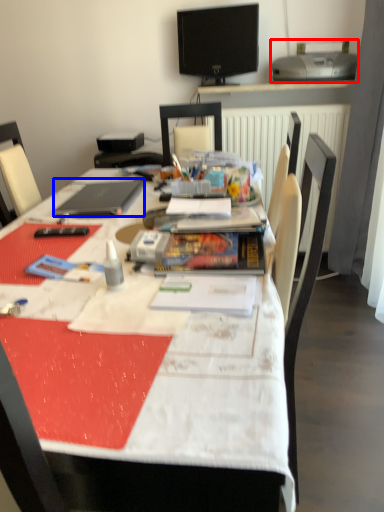
Question: Which of the following is the farthest to the observer, printer (highlighted by a red box) or laptop (highlighted by a blue box)?

Choices:
 (A) printer
 (B) laptop

Answer: (A)